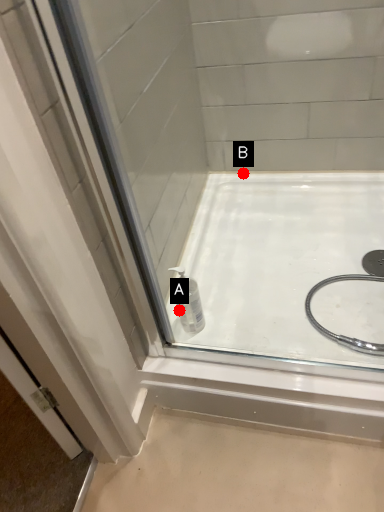
Question: Two points are circled on the image, labeled by A and B beside each circle. Which point is farther from the camera taking this photo?

Choices:
 (A) A is further
 (B) B is further

Answer: (B)